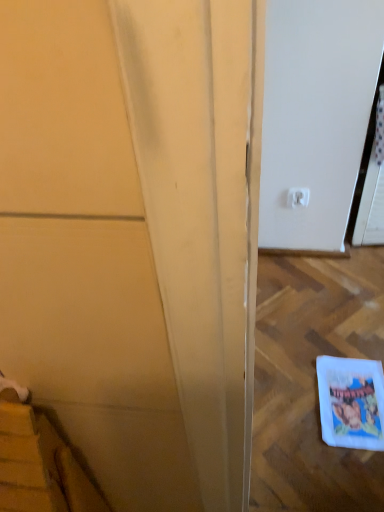
This screenshot has height=512, width=384. In order to click on free space in front of white paper comic book at lower right in this screenshot , I will do `click(348, 476)`.